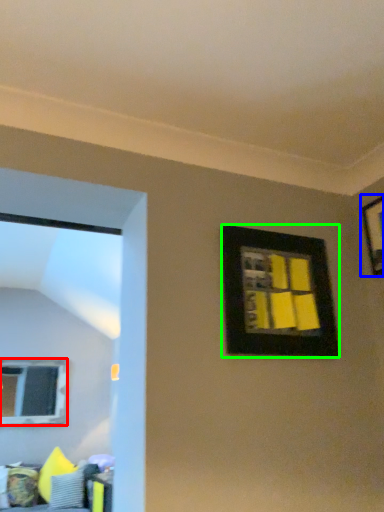
Question: Considering the real-world distances, which object is closest to window (highlighted by a red box)? picture frame (highlighted by a blue box) or picture frame (highlighted by a green box).

Choices:
 (A) picture frame
 (B) picture frame

Answer: (B)